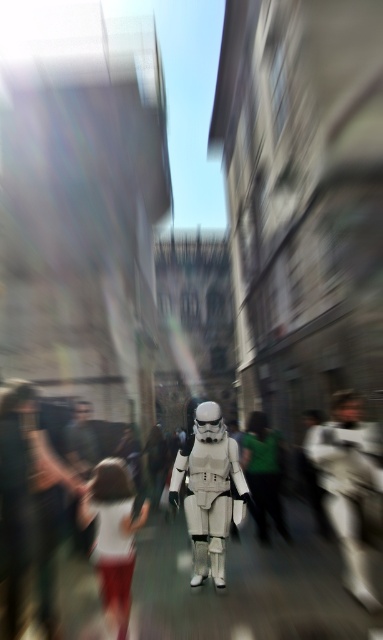
Question: Is white matte stormtrooper at center above white cotton dress at lower left?

Choices:
 (A) yes
 (B) no

Answer: (A)

Question: Which point is closer to the camera taking this photo?

Choices:
 (A) (127, 472)
 (B) (224, 448)

Answer: (A)

Question: Is white matte stormtrooper at center positioned at the back of white cotton dress at lower left?

Choices:
 (A) yes
 (B) no

Answer: (A)

Question: Is white matte stormtrooper at center above white cotton dress at lower left?

Choices:
 (A) no
 (B) yes

Answer: (B)

Question: Which point is farther to the camera?

Choices:
 (A) (194, 556)
 (B) (101, 577)

Answer: (A)